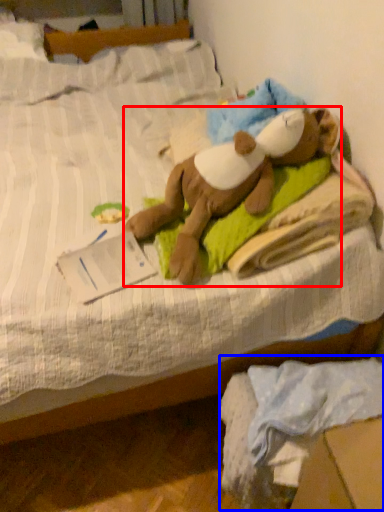
Question: Which point is closer to the camera, person (highlighted by a red box) or material (highlighted by a blue box)?

Choices:
 (A) person
 (B) material

Answer: (B)